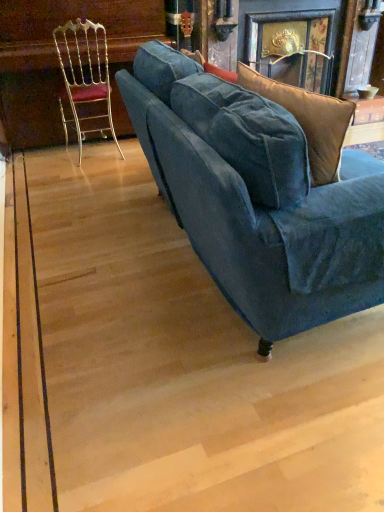
This screenshot has height=512, width=384. Describe the element at coordinates (262, 192) in the screenshot. I see `velvet blue couch at center` at that location.

What are the coordinates of `wooden table at upper right` in the screenshot? It's located at (366, 121).

In order to face wooden table at upper right, should I rotate leftwards or rightwards?

A 22.004 degree turn to the right will do.

The height and width of the screenshot is (512, 384). I want to click on gold metallic chair at left, so click(84, 74).

Locate an element on the screen. This screenshot has width=384, height=512. velvet blue couch at center is located at coordinates (x=262, y=192).

Can you tell me how much velvet blue couch at center and gold metallic chair at left differ in facing direction?

The facing directions of velvet blue couch at center and gold metallic chair at left are 88.4 degrees apart.

From the image's perspective, which one is positioned lower, velvet blue couch at center or gold metallic chair at left?

velvet blue couch at center appears lower in the image.

Is velvet blue couch at center positioned beyond the bounds of gold metallic chair at left?

velvet blue couch at center lies outside gold metallic chair at left's area.

From a real-world perspective, is velvet blue couch at center above or below gold metallic chair at left?

Clearly, from a real-world perspective, velvet blue couch at center is below gold metallic chair at left.

Does gold metallic chair at left appear on the left side of velvet blue couch at center?

Result: Indeed, gold metallic chair at left is positioned on the left side of velvet blue couch at center.

Between gold metallic chair at left and velvet blue couch at center, which one has larger width?

velvet blue couch at center.

I want to click on studio couch below the gold metallic chair at left (from a real-world perspective), so click(x=262, y=192).

Which of these two, gold metallic chair at left or velvet blue couch at center, is bigger?

velvet blue couch at center is bigger.

From their relative heights in the image, would you say wooden table at upper right is taller or shorter than velvet blue couch at center?

In the image, wooden table at upper right appears to be shorter than velvet blue couch at center.

From a real-world perspective, does wooden table at upper right sit lower than velvet blue couch at center?

Yes, from a real-world perspective, wooden table at upper right is beneath velvet blue couch at center.

Is wooden table at upper right positioned far away from velvet blue couch at center?

Yes, wooden table at upper right and velvet blue couch at center are quite far apart.

Find the location of a particular element. The height and width of the screenshot is (512, 384). chair in front of the wooden table at upper right is located at coordinates (84, 74).

From a real-world perspective, which object rests below the other?

From a 3D spatial view, wooden table at upper right is below.

From the image's perspective, would you say gold metallic chair at left is positioned over wooden table at upper right?

Incorrect, from the image's perspective, gold metallic chair at left is lower than wooden table at upper right.

Which of these two, gold metallic chair at left or wooden table at upper right, stands taller?

gold metallic chair at left is taller.

Is velvet blue couch at center inside or outside of wooden table at upper right?

velvet blue couch at center is not enclosed by wooden table at upper right.

Looking at this image, which is more to the right, velvet blue couch at center or wooden table at upper right?

From the viewer's perspective, wooden table at upper right appears more on the right side.

From the image's perspective, would you say velvet blue couch at center is positioned over wooden table at upper right?

No, from the image's perspective, velvet blue couch at center is not above wooden table at upper right.

Between velvet blue couch at center and wooden table at upper right, which one has larger width?

With larger width is velvet blue couch at center.

Is wooden table at upper right turned away from gold metallic chair at left?

That's not correct — wooden table at upper right is not looking away from gold metallic chair at left.

Is wooden table at upper right positioned in front of gold metallic chair at left?

No.

Considering the positions of points (371, 117) and (104, 76), is point (371, 117) farther from camera compared to point (104, 76)?

No.

From the image's perspective, which is above, wooden table at upper right or gold metallic chair at left?

From the image's view, wooden table at upper right is above.

Locate an element on the screen. The height and width of the screenshot is (512, 384). studio couch that appears on the right of gold metallic chair at left is located at coordinates (262, 192).

Locate an element on the screen. The width and height of the screenshot is (384, 512). studio couch in front of the gold metallic chair at left is located at coordinates (262, 192).

Estimate the real-world distances between objects in this image. Which object is closer to gold metallic chair at left, wooden table at upper right or velvet blue couch at center?

velvet blue couch at center lies closer to gold metallic chair at left than the other object.

Which object lies nearer to the anchor point velvet blue couch at center, gold metallic chair at left or wooden table at upper right?

gold metallic chair at left is positioned closer to the anchor velvet blue couch at center.

Based on their spatial positions, is velvet blue couch at center or wooden table at upper right closer to gold metallic chair at left?

velvet blue couch at center is positioned closer to the anchor gold metallic chair at left.

Considering their positions, is wooden table at upper right positioned closer to velvet blue couch at center than gold metallic chair at left?

gold metallic chair at left is closer to velvet blue couch at center.

From the image, which object appears to be nearer to wooden table at upper right, gold metallic chair at left or velvet blue couch at center?

gold metallic chair at left.

When comparing their distances from wooden table at upper right, does velvet blue couch at center or gold metallic chair at left seem further?

Based on the image, velvet blue couch at center appears to be further to wooden table at upper right.

Locate an element on the screen. chair located between velvet blue couch at center and wooden table at upper right in the depth direction is located at coordinates (84, 74).